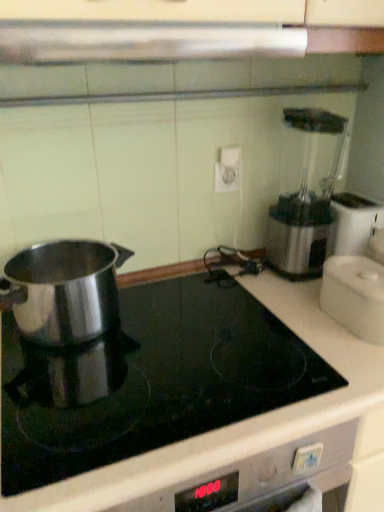
The width and height of the screenshot is (384, 512). Find the location of `free space in front of polished stainless steel pot at left, arranged as the 1th kitchen appliance when viewed from the left`. free space in front of polished stainless steel pot at left, arranged as the 1th kitchen appliance when viewed from the left is located at coordinates (74, 386).